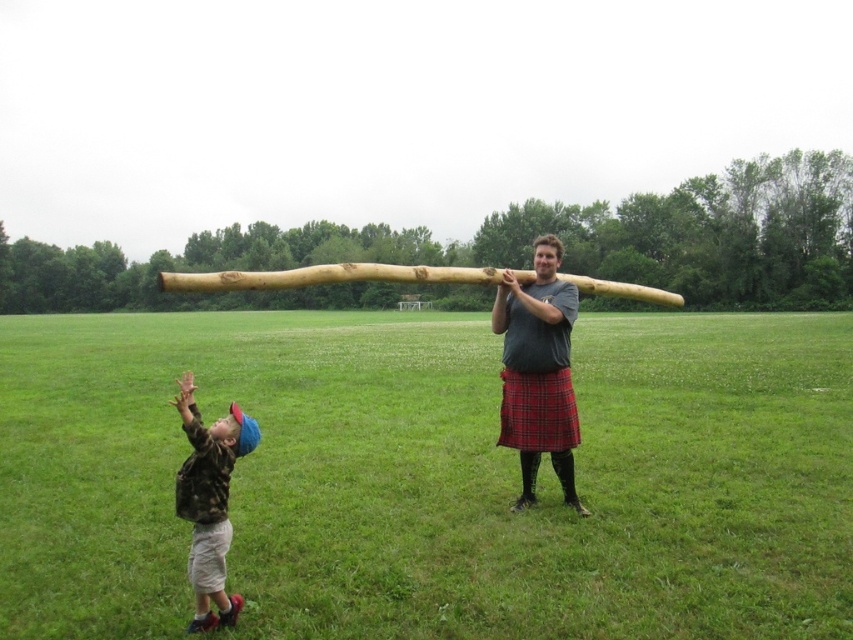
Question: Considering the relative positions of wooden log at center and camouflage fabric shirt at lower left in the image provided, where is wooden log at center located with respect to camouflage fabric shirt at lower left?

Choices:
 (A) right
 (B) left

Answer: (A)

Question: Estimate the real-world distances between objects in this image. Which object is farther from the wooden log at center?

Choices:
 (A) green grass at center
 (B) camouflage fabric shirt at lower left

Answer: (A)

Question: Does green grass at center appear over wooden log at center?

Choices:
 (A) yes
 (B) no

Answer: (A)

Question: Which point is closer to the camera?

Choices:
 (A) (216, 600)
 (B) (537, 307)
 (C) (341, 541)

Answer: (A)

Question: Does green grass at center have a lesser width compared to wooden log at center?

Choices:
 (A) no
 (B) yes

Answer: (A)

Question: Among these objects, which one is farthest from the camera?

Choices:
 (A) camouflage fabric shirt at lower left
 (B) green grass at center

Answer: (B)